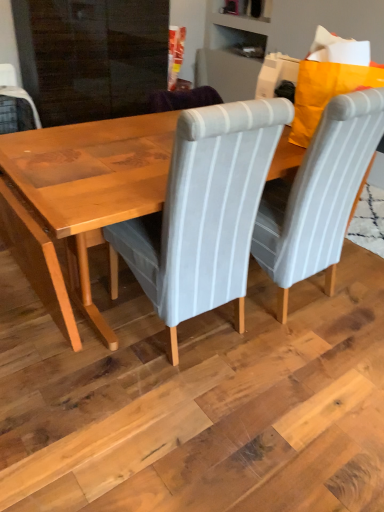
Where is `vacant space in front of gray striped fabric chair at center, the 1th chair in the right-to-left sequence`? The image size is (384, 512). vacant space in front of gray striped fabric chair at center, the 1th chair in the right-to-left sequence is located at coordinates (296, 360).